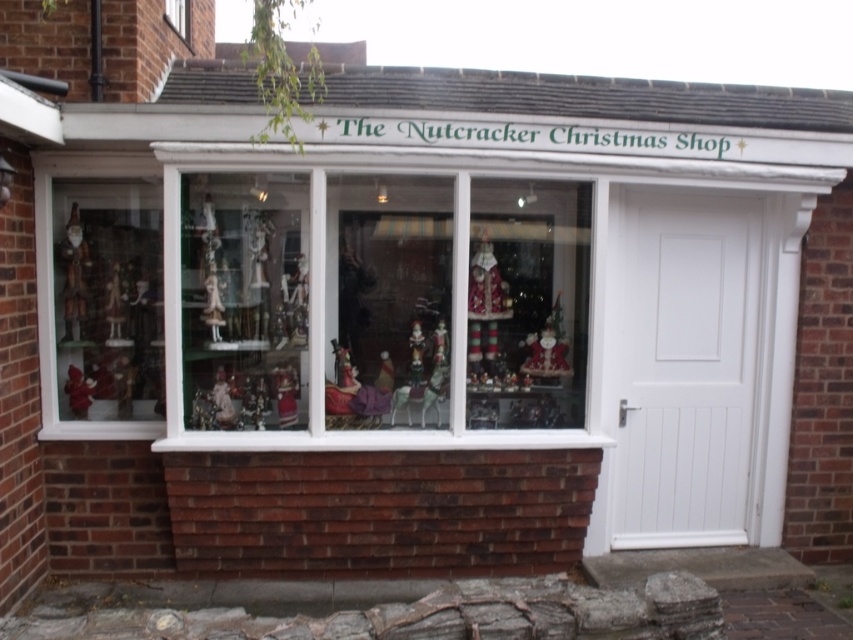
You are a customer looking at the Christmas shop window. You see the wooden figurines at left and the wooden santa at left. Which one is taller?

The wooden figurines at left are taller than the wooden santa at left.

You are standing in front of the storefront of The Nutcracker Christmas Shop and notice the translucent glass ornaments at center. Can you determine their exact position using the coordinate system provided?

The translucent glass ornaments at center are located at point (386, 310) according to the coordinate system provided.